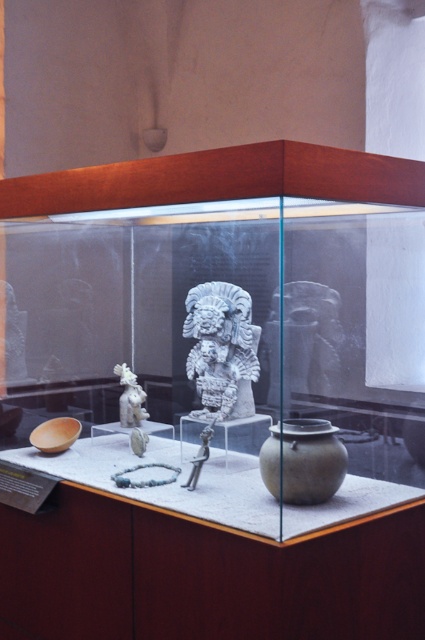
Question: Is matte gray vase at center smaller than metallic figure at center?

Choices:
 (A) no
 (B) yes

Answer: (A)

Question: Among these objects, which one is farthest from the camera?

Choices:
 (A) metallic figure at center
 (B) matte gray vase at center

Answer: (A)

Question: Is white stone carving at center to the right of white stone carving at left from the viewer's perspective?

Choices:
 (A) no
 (B) yes

Answer: (B)

Question: Does white stone sculpture at center appear over matte gray vase at center?

Choices:
 (A) yes
 (B) no

Answer: (A)

Question: Which object is closer to the camera taking this photo?

Choices:
 (A) white stone sculpture at center
 (B) metallic figure at center
 (C) white stone carving at center

Answer: (B)

Question: Which object is the farthest from the white stone figurine at center?

Choices:
 (A) white stone carving at center
 (B) metallic figure at center

Answer: (A)